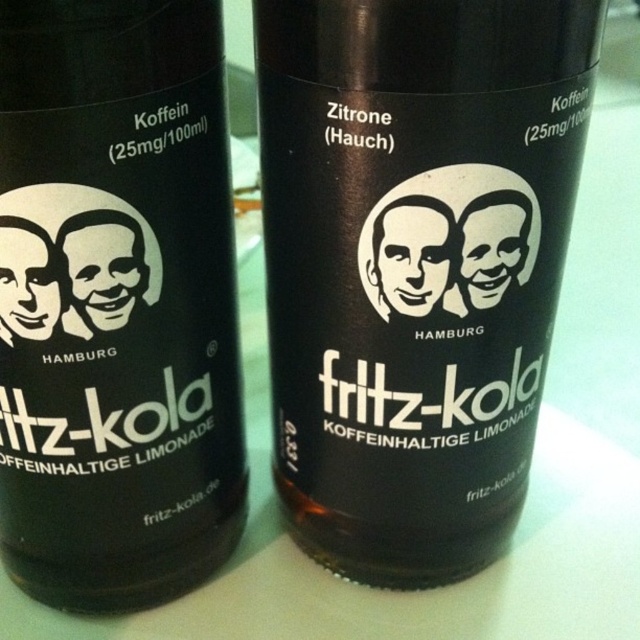
You are standing in front of two dark bottles on a table. You notice two points marked on the bottles. The first point is at coordinates point (464,35), and the second is at point (170,499). Which of these points is closer to your viewpoint?

The point (464,35) is closer to your viewpoint than the point (170,499).

You are organizing a drink station and need to place the black matte bottle at center and the brown glass bottle at center on a shelf. If the shelf has limited space and you want to place the smaller bottle first, which one should you place first?

The brown glass bottle at center is smaller than the black matte bottle at center, so you should place the brown glass bottle at center first to accommodate the smaller size before the larger one.

You are organizing a small event and need to place two bottles on a shelf. The black matte bottle at center and the brown glass bottle at center must be spaced exactly 25 centimeters apart. Based on the image, will you need to adjust their current positions to meet this requirement?

The black matte bottle at center is currently 24.97 centimeters from the brown glass bottle at center. Since this is just 0.03 centimeters less than the required 25 centimeters, you will need to make a slight adjustment to increase the distance between them to meet the exact spacing requirement.